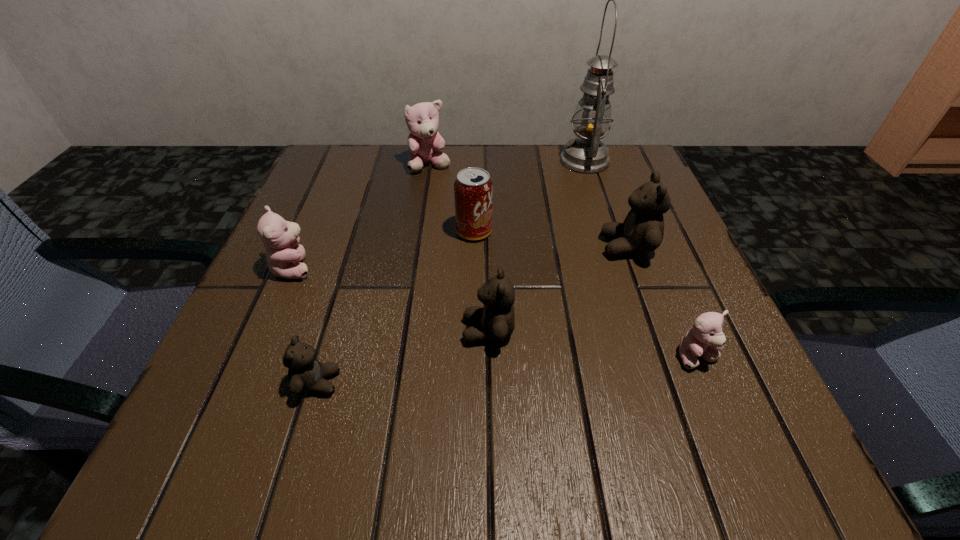
This screenshot has width=960, height=540. I want to click on the leftmost pink teddy bear, so click(280, 237).

Where is `the leftmost brown teddy bear`? the leftmost brown teddy bear is located at coordinates (305, 373).

Where is `the smallest brown teddy bear`? the smallest brown teddy bear is located at coordinates (305, 373).

Where is `the smallest pink teddy bear`? Image resolution: width=960 pixels, height=540 pixels. the smallest pink teddy bear is located at coordinates (705, 340).

I want to click on the nearest pink teddy bear, so click(x=705, y=340).

Find the location of `vacant region located 0.310m on the front of the gray oil lamp`. vacant region located 0.310m on the front of the gray oil lamp is located at coordinates (621, 274).

Locate an element on the screen. This screenshot has height=540, width=960. vacant area located 0.270m at the face of the third teddy bear from left to right is located at coordinates (417, 256).

Locate an element on the screen. This screenshot has width=960, height=540. vacant point located 0.110m on the face of the biggest brown teddy bear is located at coordinates (542, 247).

In order to click on vacant position located on the face of the biggest brown teddy bear in this screenshot , I will do `click(574, 247)`.

Image resolution: width=960 pixels, height=540 pixels. What are the coordinates of `free location located 0.300m on the face of the biggest brown teddy bear` in the screenshot? It's located at (442, 247).